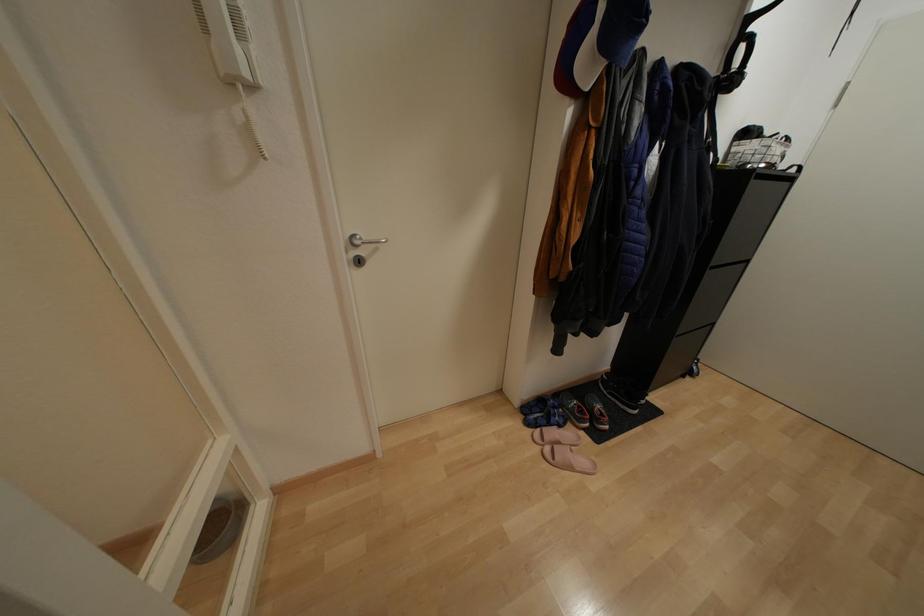
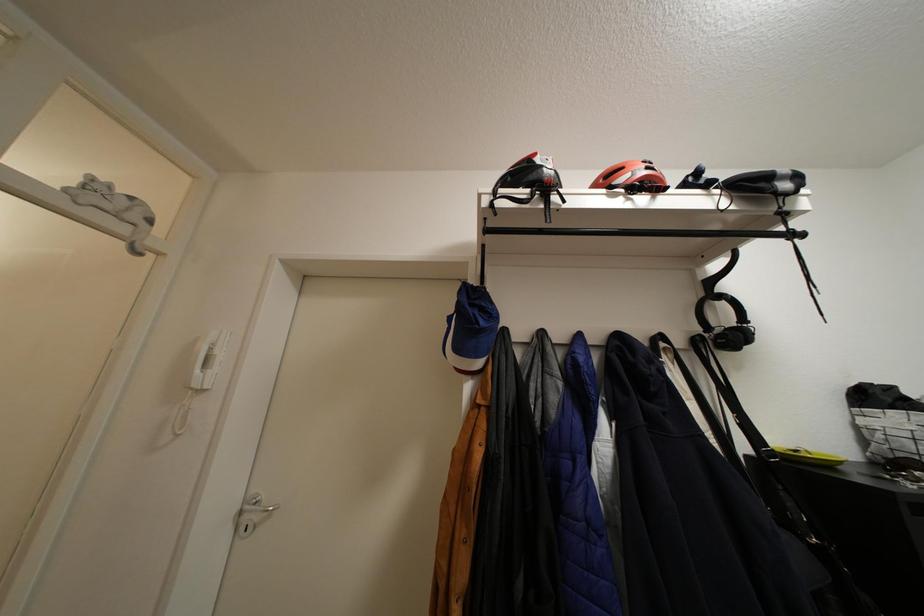
First-person continuous shooting, in which direction is the camera rotating?

The camera's rotation is toward left-up.